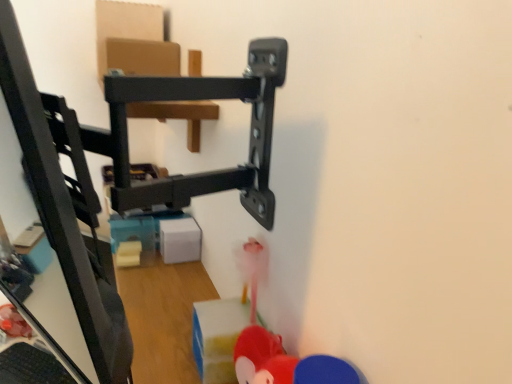
Identify the location of black plastic keyboard at lower left. (31, 366).

Identify the location of rubberized red toy at lower right, marked as the 3th toy in a back-to-front arrangement. (324, 371).

Where is `toy that is the 1st one when counting backward from the rubberized red toy at lower right, marked as the 3th toy in a back-to-front arrangement`? Image resolution: width=512 pixels, height=384 pixels. toy that is the 1st one when counting backward from the rubberized red toy at lower right, marked as the 3th toy in a back-to-front arrangement is located at coordinates (262, 358).

Measure the distance from rubberized red toy at lower right, acting as the third toy starting from the left, to rubberized red toy at lower center, the 2th toy positioned from the right.

rubberized red toy at lower right, acting as the third toy starting from the left, is 8.14 centimeters away from rubberized red toy at lower center, the 2th toy positioned from the right.

From the image's perspective, is rubberized red toy at lower right, which ranks as the first toy in right-to-left order, positioned above or below rubberized red toy at lower center, acting as the 2th toy starting from the back?

rubberized red toy at lower right, which ranks as the first toy in right-to-left order, is below rubberized red toy at lower center, acting as the 2th toy starting from the back.

In the scene shown: Is rubberized red toy at lower right, which ranks as the first toy in right-to-left order, far away from rubberized red toy at lower center, the 2th toy positioned from the right?

No.

From a real-world perspective, relative to rubberized red toy at lower right, acting as the third toy starting from the left, is rubberized red toy at lower center, marked as the 2th toy in a front-to-back arrangement, vertically above or below?

rubberized red toy at lower center, marked as the 2th toy in a front-to-back arrangement, is situated lower than rubberized red toy at lower right, acting as the third toy starting from the left, in the real world.

Considering the positions of points (269, 380) and (337, 363), is point (269, 380) closer to camera compared to point (337, 363)?

No, (269, 380) is further to viewer.

In the scene shown: Is rubberized red toy at lower center, acting as the 2th toy starting from the back, oriented towards rubberized red toy at lower right, acting as the third toy starting from the left?

No.

Is rubberized red toy at lower center, marked as the 2th toy in a front-to-back arrangement, wider than rubberized red toy at lower right, which ranks as the first toy in right-to-left order?

No, rubberized red toy at lower center, marked as the 2th toy in a front-to-back arrangement, is not wider than rubberized red toy at lower right, which ranks as the first toy in right-to-left order.

Is translucent plastic toy at lower left, acting as the first toy starting from the back, facing away from black plastic keyboard at lower left?

No, black plastic keyboard at lower left is not at the back of translucent plastic toy at lower left, acting as the first toy starting from the back.

Is there a large distance between translucent plastic toy at lower left, the 3th toy in the front-to-back sequence, and black plastic keyboard at lower left?

Actually, translucent plastic toy at lower left, the 3th toy in the front-to-back sequence, and black plastic keyboard at lower left are a little close together.

Can you confirm if translucent plastic toy at lower left, positioned as the 1th toy in left-to-right order, is bigger than black plastic keyboard at lower left?

Actually, translucent plastic toy at lower left, positioned as the 1th toy in left-to-right order, might be smaller than black plastic keyboard at lower left.

Is translucent plastic toy at lower left, positioned as the 1th toy in left-to-right order, thinner than black plastic keyboard at lower left?

Correct, the width of translucent plastic toy at lower left, positioned as the 1th toy in left-to-right order, is less than that of black plastic keyboard at lower left.

Considering the sizes of objects rubberized red toy at lower center, acting as the 2th toy starting from the back, and black plastic keyboard at lower left in the image provided, who is wider, rubberized red toy at lower center, acting as the 2th toy starting from the back, or black plastic keyboard at lower left?

Wider between the two is black plastic keyboard at lower left.

Where is `keyboard behind the rubberized red toy at lower center, marked as the 2th toy in a front-to-back arrangement`? This screenshot has height=384, width=512. keyboard behind the rubberized red toy at lower center, marked as the 2th toy in a front-to-back arrangement is located at coordinates (31, 366).

Does rubberized red toy at lower center, the 2th toy positioned from the right, contain black plastic keyboard at lower left?

That's incorrect, black plastic keyboard at lower left is not inside rubberized red toy at lower center, the 2th toy positioned from the right.

From their relative heights in the image, would you say rubberized red toy at lower center, marked as the 2th toy in a front-to-back arrangement, is taller or shorter than black plastic keyboard at lower left?

Considering their sizes, rubberized red toy at lower center, marked as the 2th toy in a front-to-back arrangement, has more height than black plastic keyboard at lower left.

Is black plastic keyboard at lower left with rubberized red toy at lower center, the 2th toy positioned from the right?

No, black plastic keyboard at lower left is not making contact with rubberized red toy at lower center, the 2th toy positioned from the right.

From a real-world perspective, which object rests below the other?

black plastic keyboard at lower left is physically lower.

Is rubberized red toy at lower center, acting as the 2th toy starting from the back, at the back of black plastic keyboard at lower left?

black plastic keyboard at lower left does not have its back to rubberized red toy at lower center, acting as the 2th toy starting from the back.

What's the angular difference between black plastic keyboard at lower left and rubberized red toy at lower center, acting as the 2th toy starting from the back,'s facing directions?

black plastic keyboard at lower left and rubberized red toy at lower center, acting as the 2th toy starting from the back, are facing 27 degrees away from each other.

Locate an element on the screen. the 3rd toy located above the black plastic keyboard at lower left (from a real-world perspective) is located at coordinates (324, 371).

Can you tell me how much rubberized red toy at lower right, which ranks as the first toy in right-to-left order, and black plastic keyboard at lower left differ in facing direction?

The angle between the facing direction of rubberized red toy at lower right, which ranks as the first toy in right-to-left order, and the facing direction of black plastic keyboard at lower left is 44.3 degrees.

Could you tell me if rubberized red toy at lower right, marked as the 3th toy in a back-to-front arrangement, is turned towards black plastic keyboard at lower left?

No.

Considering the sizes of rubberized red toy at lower right, acting as the third toy starting from the left, and black plastic keyboard at lower left in the image, is rubberized red toy at lower right, acting as the third toy starting from the left, bigger or smaller than black plastic keyboard at lower left?

rubberized red toy at lower right, acting as the third toy starting from the left, is smaller than black plastic keyboard at lower left.

Looking at the image, does black plastic keyboard at lower left seem bigger or smaller compared to translucent plastic toy at lower left, the 3th toy in the front-to-back sequence?

In the image, black plastic keyboard at lower left appears to be larger than translucent plastic toy at lower left, the 3th toy in the front-to-back sequence.

From a real-world perspective, is black plastic keyboard at lower left physically above translucent plastic toy at lower left, which ranks as the 3th toy in right-to-left order?

Incorrect, from a real-world perspective, black plastic keyboard at lower left is lower than translucent plastic toy at lower left, which ranks as the 3th toy in right-to-left order.

Is black plastic keyboard at lower left facing towards translucent plastic toy at lower left, which ranks as the 3th toy in right-to-left order?

No.

From a real-world perspective, count 1st toys downward from the rubberized red toy at lower right, acting as the third toy starting from the left, and point to it. Please provide its 2D coordinates.

[(262, 358)]

At what (x,y) coordinates should I click in order to perform the action: click on toy that is the 1st object located behind the rubberized red toy at lower right, marked as the 3th toy in a back-to-front arrangement. Please return your answer as a coordinate pair (x, y). The height and width of the screenshot is (384, 512). Looking at the image, I should click on (262, 358).

In the scene shown: Looking at the image, which one is located further to rubberized red toy at lower center, acting as the 2th toy starting from the back, black plastic keyboard at lower left or translucent plastic toy at lower left, which ranks as the 3th toy in right-to-left order?

The object further to rubberized red toy at lower center, acting as the 2th toy starting from the back, is translucent plastic toy at lower left, which ranks as the 3th toy in right-to-left order.

When comparing their distances from black plastic keyboard at lower left, does rubberized red toy at lower right, marked as the 3th toy in a back-to-front arrangement, or rubberized red toy at lower center, the 2th toy positioned from the right, seem further?

Based on the image, rubberized red toy at lower right, marked as the 3th toy in a back-to-front arrangement, appears to be further to black plastic keyboard at lower left.

Looking at the image, which one is located closer to translucent plastic toy at lower left, acting as the first toy starting from the back, rubberized red toy at lower center, acting as the 2th toy starting from the back, or black plastic keyboard at lower left?

The object closer to translucent plastic toy at lower left, acting as the first toy starting from the back, is black plastic keyboard at lower left.

Estimate the real-world distances between objects in this image. Which object is closer to translucent plastic toy at lower left, the 3th toy in the front-to-back sequence, rubberized red toy at lower center, acting as the 2th toy starting from the back, or rubberized red toy at lower right, the first toy viewed from the front?

Based on the image, rubberized red toy at lower center, acting as the 2th toy starting from the back, appears to be nearer to translucent plastic toy at lower left, the 3th toy in the front-to-back sequence.

Which object lies nearer to the anchor point translucent plastic toy at lower left, the 3th toy in the front-to-back sequence, black plastic keyboard at lower left or rubberized red toy at lower center, acting as the 2th toy starting from the back?

Based on the image, black plastic keyboard at lower left appears to be nearer to translucent plastic toy at lower left, the 3th toy in the front-to-back sequence.

Considering their positions, is rubberized red toy at lower center, the 2th toy positioned from the right, positioned closer to black plastic keyboard at lower left than translucent plastic toy at lower left, positioned as the 1th toy in left-to-right order?

translucent plastic toy at lower left, positioned as the 1th toy in left-to-right order, is closer to black plastic keyboard at lower left.

Estimate the real-world distances between objects in this image. Which object is further from black plastic keyboard at lower left, translucent plastic toy at lower left, acting as the first toy starting from the back, or rubberized red toy at lower right, which ranks as the first toy in right-to-left order?

rubberized red toy at lower right, which ranks as the first toy in right-to-left order, lies further to black plastic keyboard at lower left than the other object.

Based on the photo, considering their positions, is rubberized red toy at lower right, acting as the third toy starting from the left, positioned further to translucent plastic toy at lower left, which ranks as the 3th toy in right-to-left order, than black plastic keyboard at lower left?

Based on the image, rubberized red toy at lower right, acting as the third toy starting from the left, appears to be further to translucent plastic toy at lower left, which ranks as the 3th toy in right-to-left order.

I want to click on toy between rubberized red toy at lower right, marked as the 3th toy in a back-to-front arrangement, and black plastic keyboard at lower left, along the z-axis, so (x=262, y=358).

At what (x,y) coordinates should I click in order to perform the action: click on toy between rubberized red toy at lower right, which ranks as the first toy in right-to-left order, and translucent plastic toy at lower left, acting as the first toy starting from the back, from front to back. Please return your answer as a coordinate pair (x, y). Image resolution: width=512 pixels, height=384 pixels. Looking at the image, I should click on (262, 358).

Image resolution: width=512 pixels, height=384 pixels. I want to click on keyboard between rubberized red toy at lower center, marked as the 2th toy in a front-to-back arrangement, and translucent plastic toy at lower left, acting as the first toy starting from the back, in the front-back direction, so click(x=31, y=366).

This screenshot has height=384, width=512. I want to click on keyboard between rubberized red toy at lower right, which ranks as the first toy in right-to-left order, and translucent plastic toy at lower left, which ranks as the 3th toy in right-to-left order, in the front-back direction, so click(31, 366).